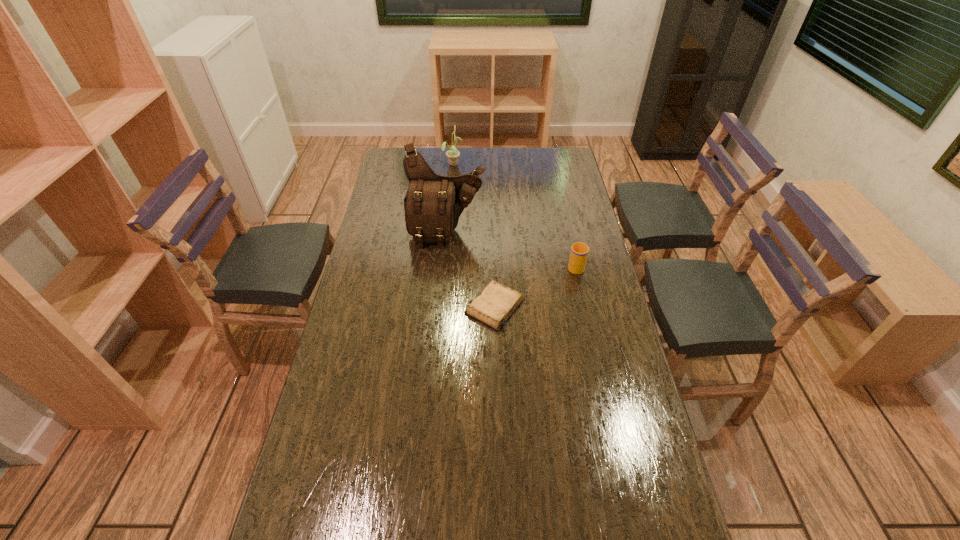
Locate an element on the screen. The image size is (960, 540). free space at the far right corner of the desktop is located at coordinates (565, 161).

Where is `vacant space in between the cup and the sunflower`? This screenshot has width=960, height=540. vacant space in between the cup and the sunflower is located at coordinates (514, 215).

Find the location of `free space between the shortest object and the sunflower`. free space between the shortest object and the sunflower is located at coordinates (473, 235).

This screenshot has width=960, height=540. Identify the location of unoccupied area between the shortest object and the cup. (535, 286).

The width and height of the screenshot is (960, 540). In order to click on vacant area between the second shortest object and the shoulder bag in this screenshot , I will do `click(511, 250)`.

You are a GUI agent. You are given a task and a screenshot of the screen. Output one action in this format:
    pyautogui.click(x=<x>, y=<y>)
    Task: Click on the vacant space that's between the shoulder bag and the cup
    
    Given the screenshot: What is the action you would take?
    pyautogui.click(x=511, y=250)

The height and width of the screenshot is (540, 960). Identify the location of free space between the diary and the farthest object. (473, 235).

Identify which object is located as the second nearest to the tallest object. Please provide its 2D coordinates. Your answer should be formatted as a tuple, i.e. [(x, y)], where the tuple contains the x and y coordinates of a point satisfying the conditions above.

[(579, 252)]

Find the location of a particular element. The image size is (960, 540). object that is the second nearest to the nearest object is located at coordinates (433, 204).

Locate an element on the screen. vacant region that satisfies the following two spatial constraints: 1. on the front-facing side of the third shortest object; 2. on the front-facing side of the tallest object is located at coordinates (446, 234).